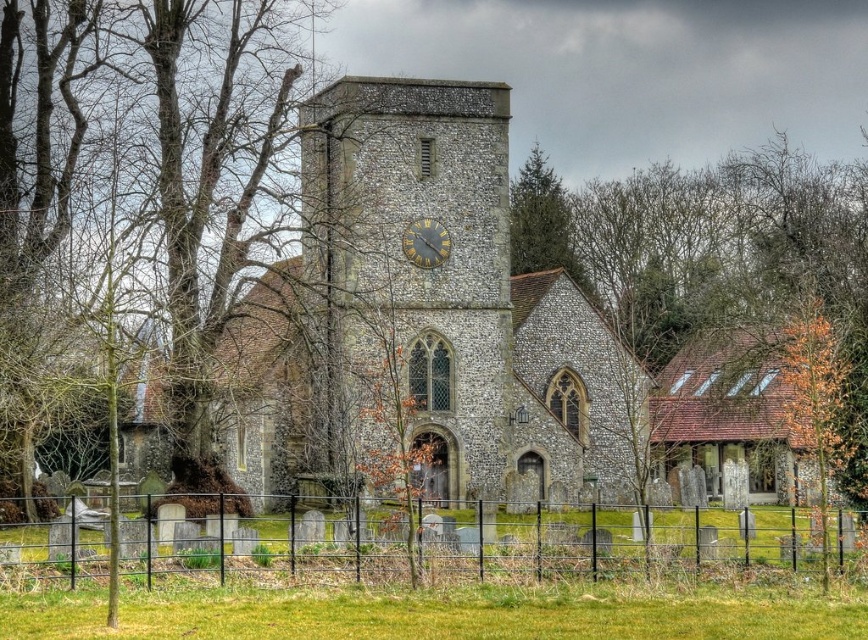
Question: Is green textured pine tree at upper center closer to camera compared to dark brown wooden clock at center?

Choices:
 (A) yes
 (B) no

Answer: (B)

Question: Which point is farther to the camera?

Choices:
 (A) (556, 476)
 (B) (536, 196)

Answer: (B)

Question: Which point appears closest to the camera in this image?

Choices:
 (A) (834, 545)
 (B) (586, 285)
 (C) (372, 208)

Answer: (A)

Question: Does stone church at center appear under stone clock tower at center?

Choices:
 (A) no
 (B) yes

Answer: (B)

Question: Which point is closer to the camera?

Choices:
 (A) (409, 230)
 (B) (561, 259)
 (C) (456, 340)

Answer: (A)

Question: Is stone clock tower at center to the right of dark brown wooden clock at center from the viewer's perspective?

Choices:
 (A) yes
 (B) no

Answer: (B)